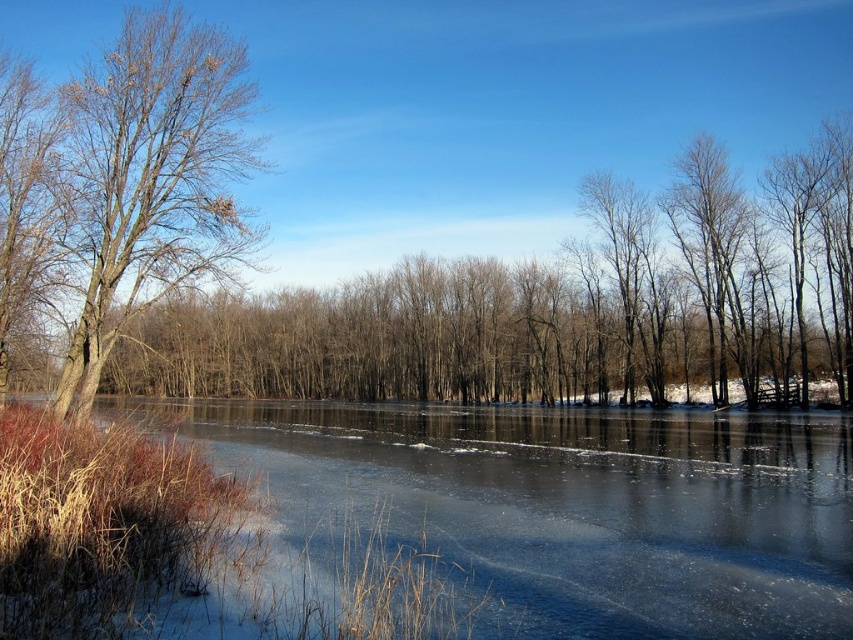
Question: Which of the following is the closest to the observer?

Choices:
 (A) (601, 449)
 (B) (164, 109)

Answer: (A)

Question: Does frozen ice at center appear on the left side of bare wood tree at left?

Choices:
 (A) no
 (B) yes

Answer: (A)

Question: Can you confirm if frozen ice at center is smaller than bare wood tree at left?

Choices:
 (A) yes
 (B) no

Answer: (B)

Question: Which point is farther to the camera?

Choices:
 (A) bare wood tree at left
 (B) frozen ice at center

Answer: (A)

Question: Does frozen ice at center have a lesser width compared to bare wood tree at left?

Choices:
 (A) yes
 (B) no

Answer: (B)